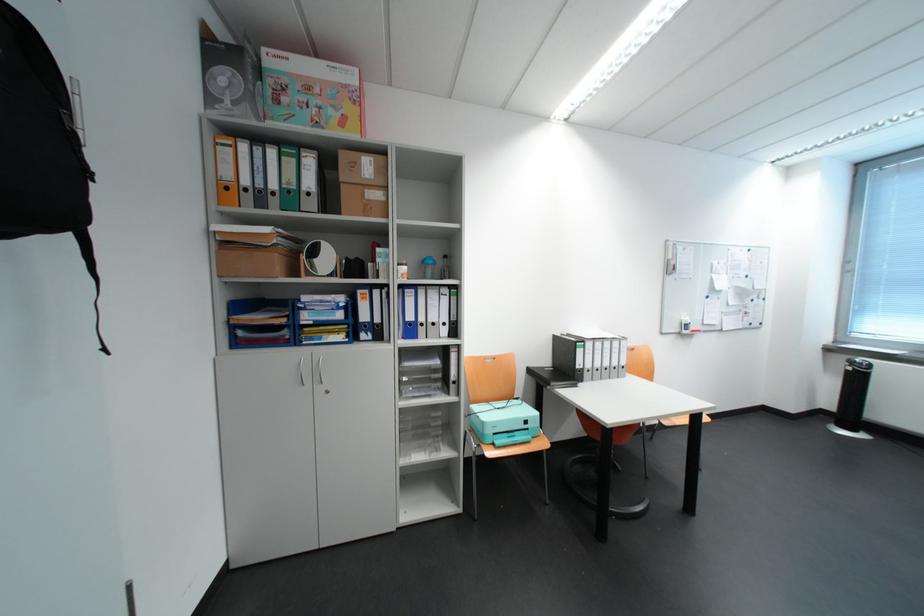
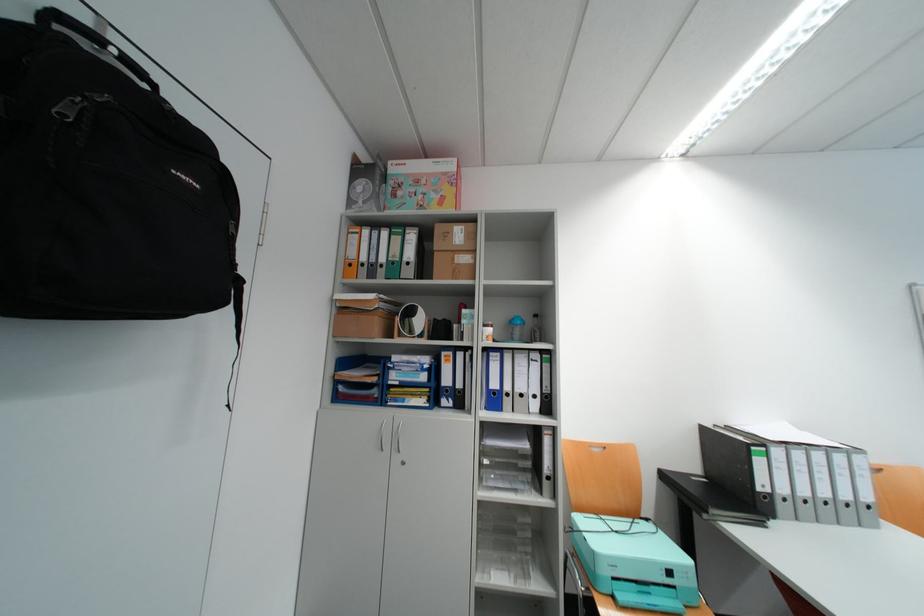
Locate, in the second image, the point that corresponds to [329,326] in the first image.

(415, 387)